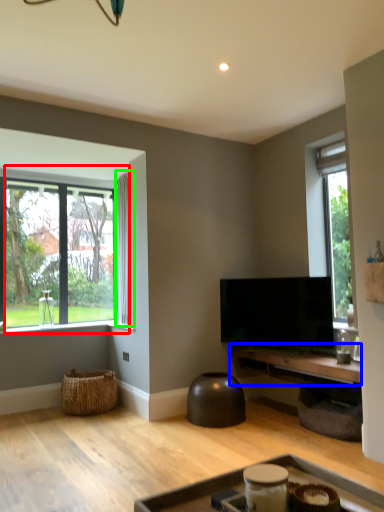
Question: Which object is positioned closest to window (highlighted by a red box)? Select from table (highlighted by a blue box) and curtain (highlighted by a green box).

Choices:
 (A) table
 (B) curtain

Answer: (B)